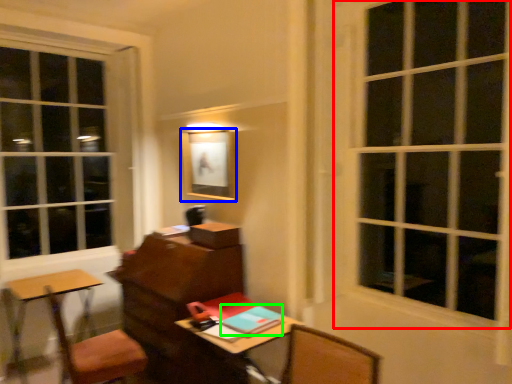
Question: Which object is the farthest from window (highlighted by a red box)? Choose among these: picture frame (highlighted by a blue box) or notebook (highlighted by a green box).

Choices:
 (A) picture frame
 (B) notebook

Answer: (B)